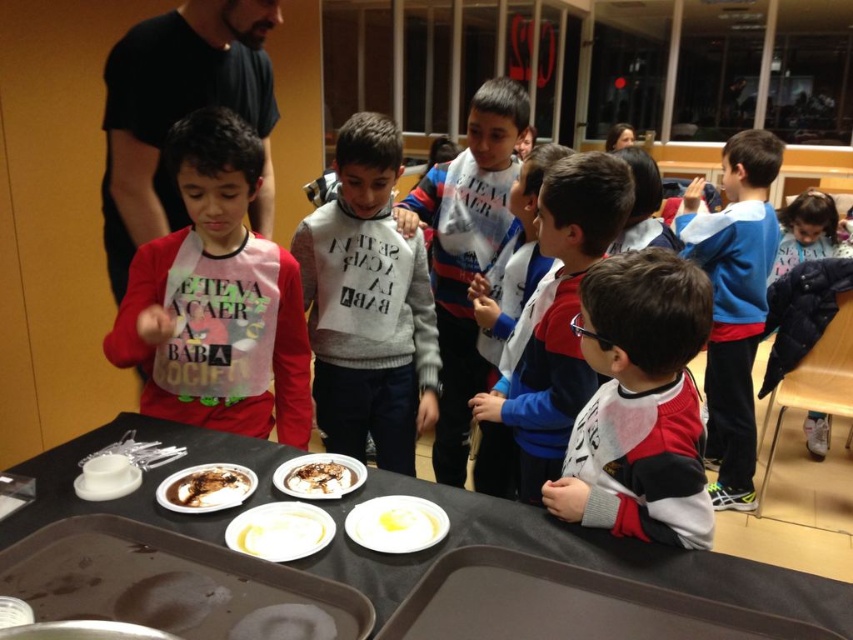
Question: Is matte red sweater at left to the left of blue fleece sweater at upper right from the viewer's perspective?

Choices:
 (A) yes
 (B) no

Answer: (A)

Question: Which object is positioned farthest from the blue fleece sweater at upper right?

Choices:
 (A) black puffer jacket at upper right
 (B) chocolate glazed donut at lower left
 (C) matte red sweater at left
 (D) gray sweater at center

Answer: (B)

Question: Which object appears farthest from the camera in this image?

Choices:
 (A) white matte shirt at center
 (B) gray sweater at center
 (C) brown plastic tray at lower center

Answer: (B)

Question: Which of the following is the farthest from the observer?

Choices:
 (A) gray sweater at center
 (B) white glossy plate at center
 (C) chocolate glazed donut at lower left

Answer: (A)

Question: In this image, where is white cotton sweater at center located relative to yellow creamy food at lower center?

Choices:
 (A) left
 (B) right

Answer: (B)

Question: Is white matte shirt at center thinner than chocolate glazed donut at lower left?

Choices:
 (A) yes
 (B) no

Answer: (B)